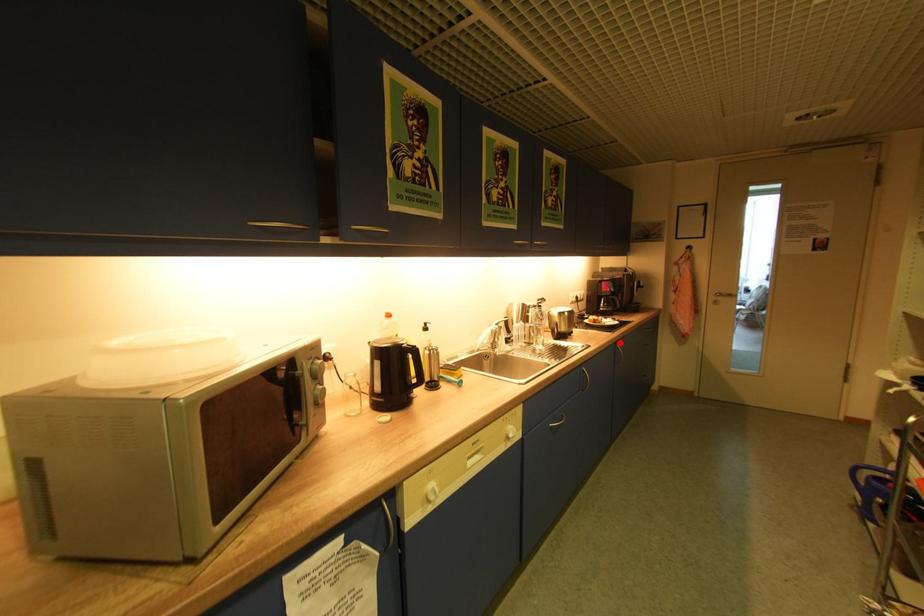
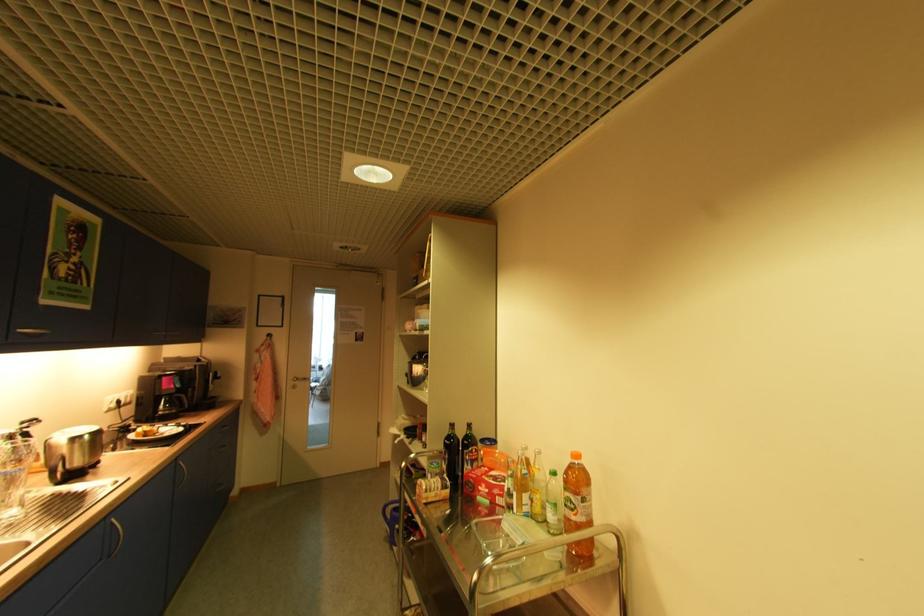
In the second image, find the point that corresponds to the highlighted location in the first image.

(179, 459)